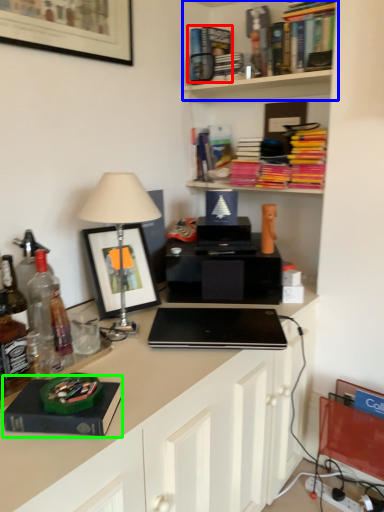
Question: Which is nearer to the book (highlighted by a red box)? shelf (highlighted by a blue box) or paperback book (highlighted by a green box).

Choices:
 (A) shelf
 (B) paperback book

Answer: (A)